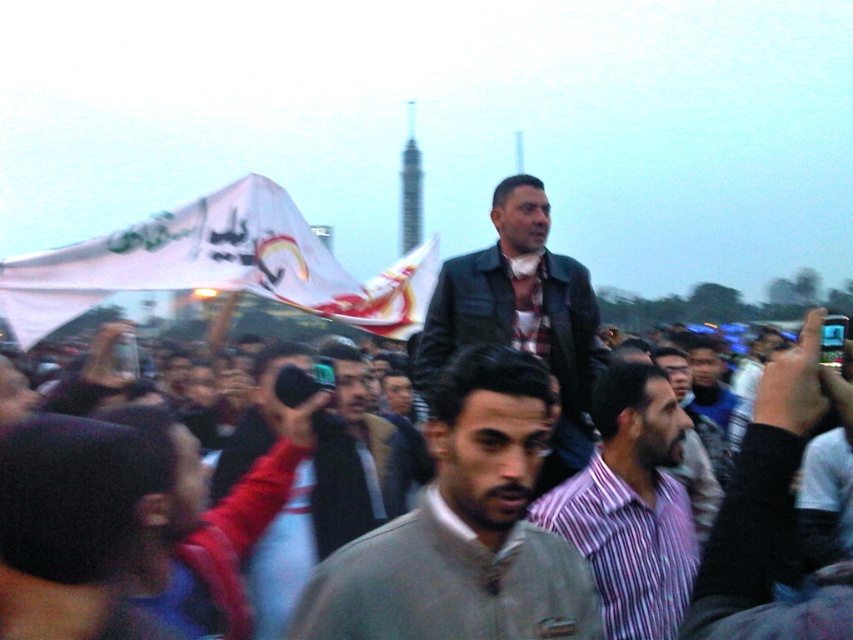
Who is higher up, white fabric flag at upper left or gray sweater at center?

Positioned higher is white fabric flag at upper left.

Looking at this image, can you confirm if white fabric flag at upper left is positioned to the left of gray sweater at center?

Indeed, white fabric flag at upper left is positioned on the left side of gray sweater at center.

The width and height of the screenshot is (853, 640). I want to click on white fabric flag at upper left, so click(216, 266).

The width and height of the screenshot is (853, 640). Find the location of `white fabric flag at upper left`. white fabric flag at upper left is located at coordinates (216, 266).

Between gray matte jacket at center and gray sweater at center, which one has more height?

Standing taller between the two is gray sweater at center.

Can you confirm if gray matte jacket at center is positioned to the right of gray sweater at center?

Incorrect, gray matte jacket at center is not on the right side of gray sweater at center.

Image resolution: width=853 pixels, height=640 pixels. Identify the location of gray matte jacket at center. (463, 529).

Which is more to the right, gray matte jacket at center or striped cotton shirt at center?

Positioned to the right is striped cotton shirt at center.

Who is lower down, gray matte jacket at center or striped cotton shirt at center?

gray matte jacket at center

Between point (512, 630) and point (616, 372), which one is positioned behind?

Point (616, 372)

Find the location of a particular element. This screenshot has height=640, width=853. gray matte jacket at center is located at coordinates (463, 529).